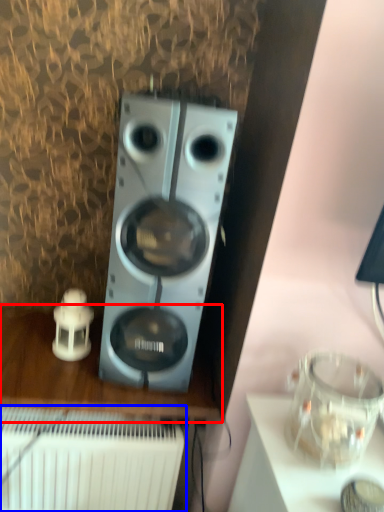
Question: Among these objects, which one is nearest to the camera, furniture (highlighted by a red box) or radiator (highlighted by a blue box)?

Choices:
 (A) furniture
 (B) radiator

Answer: (B)